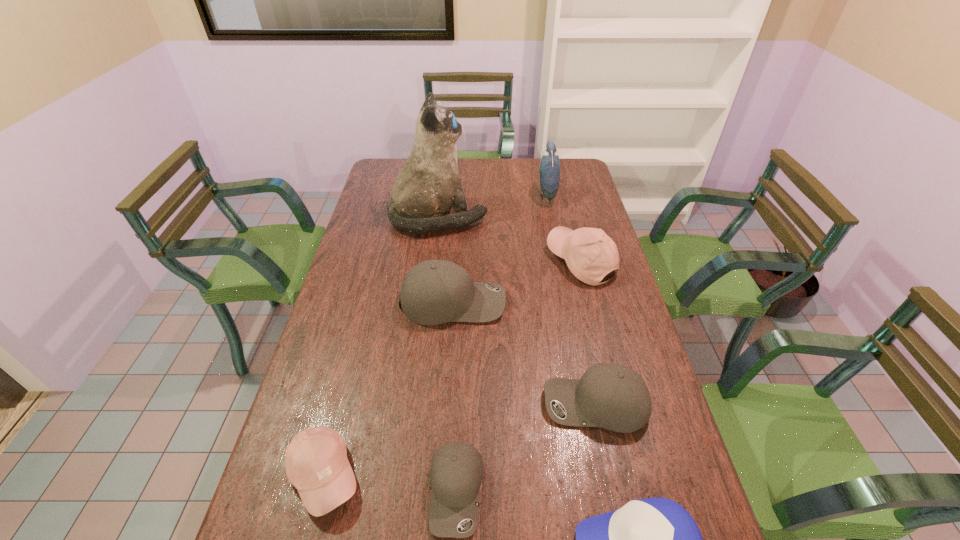
Find the location of `the tallest object`. the tallest object is located at coordinates (429, 184).

This screenshot has width=960, height=540. Find the location of `bird`. bird is located at coordinates (549, 170).

Locate an element on the screen. Image resolution: width=960 pixels, height=540 pixels. blue bird is located at coordinates (549, 170).

Locate an element on the screen. This screenshot has width=960, height=540. the biggest gray baseball cap is located at coordinates (433, 292).

This screenshot has width=960, height=540. Find the location of `the right pink baseball cap`. the right pink baseball cap is located at coordinates (590, 254).

This screenshot has width=960, height=540. I want to click on the farther pink baseball cap, so click(x=590, y=254).

I want to click on the second smallest gray baseball cap, so click(x=612, y=396).

Locate an element on the screen. the second nearest gray baseball cap is located at coordinates (612, 396).

Where is `the leftmost baseball cap`? the leftmost baseball cap is located at coordinates (316, 462).

At what (x,y) coordinates should I click in order to perform the action: click on the left pink baseball cap. Please return your answer as a coordinate pair (x, y). Looking at the image, I should click on (316, 462).